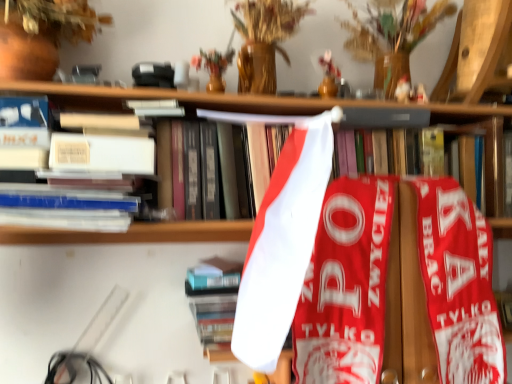
You are a GUI agent. You are given a task and a screenshot of the screen. Output one action in this format:
    pyautogui.click(x=<x>, y=<y>)
    Task: Click on the white paper at upper center, acting as the second book starting from the bottom
    Image resolution: width=512 pixels, height=384 pixels.
    Given the screenshot: What is the action you would take?
    pyautogui.click(x=262, y=156)

Based on the photo, measure the distance between point (x=268, y=146) and camera.

A distance of 36.02 inches exists between point (x=268, y=146) and camera.

This screenshot has width=512, height=384. Describe the element at coordinates (262, 156) in the screenshot. I see `white paper at upper center, positioned as the 1th book in top-to-bottom order` at that location.

What is the approximate width of white paper at upper center, positioned as the 1th book in top-to-bottom order?

It is 9.46 inches.

In order to click on hardcover book at center, which is counted as the second book, starting from the top in this screenshot , I will do `click(213, 298)`.

What is the approximate height of hardcover book at center, which is counted as the second book, starting from the top?

6.01 inches.

This screenshot has height=384, width=512. Describe the element at coordinates (213, 298) in the screenshot. I see `hardcover book at center, which is counted as the second book, starting from the top` at that location.

Where is `white paper at upper center, acting as the second book starting from the bottom`? The image size is (512, 384). white paper at upper center, acting as the second book starting from the bottom is located at coordinates (262, 156).

Which is more to the right, white paper at upper center, positioned as the 1th book in top-to-bottom order, or hardcover book at center, which is counted as the second book, starting from the top?

Positioned to the right is white paper at upper center, positioned as the 1th book in top-to-bottom order.

Between white paper at upper center, acting as the second book starting from the bottom, and hardcover book at center, which is counted as the second book, starting from the top, which one is positioned in front?

Positioned in front is white paper at upper center, acting as the second book starting from the bottom.

Is point (265, 149) less distant than point (193, 295)?

That is True.

From the image's perspective, which is below, white paper at upper center, acting as the second book starting from the bottom, or hardcover book at center, which is counted as the second book, starting from the top?

hardcover book at center, which is counted as the second book, starting from the top, appears lower in the image.

From a real-world perspective, who is located lower, white paper at upper center, acting as the second book starting from the bottom, or hardcover book at center, which is counted as the second book, starting from the top?

In real-world perspective, hardcover book at center, which is counted as the second book, starting from the top, is lower.

Is white paper at upper center, acting as the second book starting from the bottom, thinner than hardcover book at center, placed as the first book when sorted from bottom to top?

In fact, white paper at upper center, acting as the second book starting from the bottom, might be wider than hardcover book at center, placed as the first book when sorted from bottom to top.

In the scene shown: Considering the sizes of white paper at upper center, acting as the second book starting from the bottom, and hardcover book at center, which is counted as the second book, starting from the top, in the image, is white paper at upper center, acting as the second book starting from the bottom, taller or shorter than hardcover book at center, which is counted as the second book, starting from the top,?

In the image, white paper at upper center, acting as the second book starting from the bottom, appears to be taller than hardcover book at center, which is counted as the second book, starting from the top.

Based on their sizes in the image, would you say white paper at upper center, acting as the second book starting from the bottom, is bigger or smaller than hardcover book at center, which is counted as the second book, starting from the top?

Considering their sizes, white paper at upper center, acting as the second book starting from the bottom, takes up more space than hardcover book at center, which is counted as the second book, starting from the top.

Looking at this image, is white paper at upper center, acting as the second book starting from the bottom, completely or partially outside of hardcover book at center, placed as the first book when sorted from bottom to top?

Yes, white paper at upper center, acting as the second book starting from the bottom, is located beyond the bounds of hardcover book at center, placed as the first book when sorted from bottom to top.

Is white paper at upper center, positioned as the 1th book in top-to-bottom order, in contact with hardcover book at center, placed as the first book when sorted from bottom to top?

They are not placed beside each other.

Does white paper at upper center, positioned as the 1th book in top-to-bottom order, turn towards hardcover book at center, placed as the first book when sorted from bottom to top?

No, white paper at upper center, positioned as the 1th book in top-to-bottom order, is not facing towards hardcover book at center, placed as the first book when sorted from bottom to top.

Consider the image. Measure the distance between white paper at upper center, acting as the second book starting from the bottom, and hardcover book at center, placed as the first book when sorted from bottom to top.

white paper at upper center, acting as the second book starting from the bottom, and hardcover book at center, placed as the first book when sorted from bottom to top, are 9.67 inches apart from each other.

You are a GUI agent. You are given a task and a screenshot of the screen. Output one action in this format:
    pyautogui.click(x=<x>, y=<y>)
    Task: Click on the book in front of the hardcover book at center, placed as the first book when sorted from bottom to top
    This screenshot has height=384, width=512.
    Given the screenshot: What is the action you would take?
    pyautogui.click(x=262, y=156)

In the image, is hardcover book at center, placed as the first book when sorted from bottom to top, on the left side or the right side of white paper at upper center, acting as the second book starting from the bottom?

hardcover book at center, placed as the first book when sorted from bottom to top, is to the left of white paper at upper center, acting as the second book starting from the bottom.

Is the position of hardcover book at center, placed as the first book when sorted from bottom to top, less distant than that of white paper at upper center, acting as the second book starting from the bottom?

No, it is not.

Which is closer to the camera, (x=192, y=306) or (x=174, y=150)?

Point (x=192, y=306) appears to be farther away from the viewer than point (x=174, y=150).

From the image's perspective, would you say hardcover book at center, which is counted as the second book, starting from the top, is shown under white paper at upper center, positioned as the 1th book in top-to-bottom order?

Yes.

From a real-world perspective, is hardcover book at center, placed as the first book when sorted from bottom to top, positioned under white paper at upper center, acting as the second book starting from the bottom, based on gravity?

Yes.

Can you confirm if hardcover book at center, placed as the first book when sorted from bottom to top, is wider than white paper at upper center, acting as the second book starting from the bottom?

In fact, hardcover book at center, placed as the first book when sorted from bottom to top, might be narrower than white paper at upper center, acting as the second book starting from the bottom.

Which of these two, hardcover book at center, placed as the first book when sorted from bottom to top, or white paper at upper center, positioned as the 1th book in top-to-bottom order, stands taller?

With more height is white paper at upper center, positioned as the 1th book in top-to-bottom order.

Considering the sizes of hardcover book at center, placed as the first book when sorted from bottom to top, and white paper at upper center, positioned as the 1th book in top-to-bottom order, in the image, is hardcover book at center, placed as the first book when sorted from bottom to top, bigger or smaller than white paper at upper center, positioned as the 1th book in top-to-bottom order,?

hardcover book at center, placed as the first book when sorted from bottom to top, is smaller than white paper at upper center, positioned as the 1th book in top-to-bottom order.

Is white paper at upper center, positioned as the 1th book in top-to-bottom order, inside hardcover book at center, which is counted as the second book, starting from the top?

No, white paper at upper center, positioned as the 1th book in top-to-bottom order, is not a part of hardcover book at center, which is counted as the second book, starting from the top.

Can you see hardcover book at center, which is counted as the second book, starting from the top, touching white paper at upper center, acting as the second book starting from the bottom?

No, hardcover book at center, which is counted as the second book, starting from the top, is not in contact with white paper at upper center, acting as the second book starting from the bottom.

Is hardcover book at center, placed as the first book when sorted from bottom to top, turned away from white paper at upper center, acting as the second book starting from the bottom?

No.

Can you tell me how much hardcover book at center, placed as the first book when sorted from bottom to top, and white paper at upper center, positioned as the 1th book in top-to-bottom order, differ in facing direction?

hardcover book at center, placed as the first book when sorted from bottom to top, and white paper at upper center, positioned as the 1th book in top-to-bottom order, are facing 0.642 degrees away from each other.

Image resolution: width=512 pixels, height=384 pixels. I want to click on book on the right of the hardcover book at center, which is counted as the second book, starting from the top, so click(262, 156).

Locate an element on the screen. book directly beneath the white paper at upper center, positioned as the 1th book in top-to-bottom order (from a real-world perspective) is located at coordinates (213, 298).

Locate an element on the screen. book on the left side of white paper at upper center, positioned as the 1th book in top-to-bottom order is located at coordinates point(213,298).